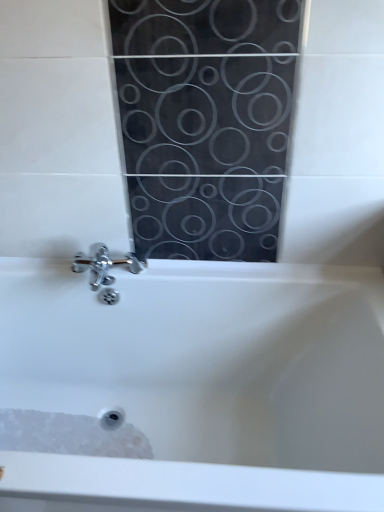
Question: Should I look upward or downward to see white textured foam at bottom left?

Choices:
 (A) down
 (B) up

Answer: (A)

Question: Does white glossy bathtub at center appear on the left side of white textured foam at bottom left?

Choices:
 (A) no
 (B) yes

Answer: (A)

Question: From the image's perspective, would you say white glossy bathtub at center is positioned over white textured foam at bottom left?

Choices:
 (A) no
 (B) yes

Answer: (B)

Question: Is there a large distance between white glossy bathtub at center and white textured foam at bottom left?

Choices:
 (A) no
 (B) yes

Answer: (A)

Question: Is white glossy bathtub at center positioned before white textured foam at bottom left?

Choices:
 (A) no
 (B) yes

Answer: (B)

Question: Can you confirm if white glossy bathtub at center is shorter than white textured foam at bottom left?

Choices:
 (A) yes
 (B) no

Answer: (B)

Question: From a real-world perspective, is white glossy bathtub at center beneath white textured foam at bottom left?

Choices:
 (A) no
 (B) yes

Answer: (A)

Question: Is white textured foam at bottom left smaller than white glossy bathtub at center?

Choices:
 (A) no
 (B) yes

Answer: (B)

Question: Is white textured foam at bottom left not close to white glossy bathtub at center?

Choices:
 (A) yes
 (B) no

Answer: (B)

Question: Is white textured foam at bottom left not inside white glossy bathtub at center?

Choices:
 (A) yes
 (B) no

Answer: (B)

Question: Is white textured foam at bottom left closer to camera compared to white glossy bathtub at center?

Choices:
 (A) no
 (B) yes

Answer: (A)

Question: Is white textured foam at bottom left behind white glossy bathtub at center?

Choices:
 (A) no
 (B) yes

Answer: (B)

Question: From the image's perspective, is white textured foam at bottom left above white glossy bathtub at center?

Choices:
 (A) no
 (B) yes

Answer: (A)

Question: Considering the relative positions of white glossy bathtub at center and white textured foam at bottom left in the image provided, is white glossy bathtub at center to the left or to the right of white textured foam at bottom left?

Choices:
 (A) left
 (B) right

Answer: (B)